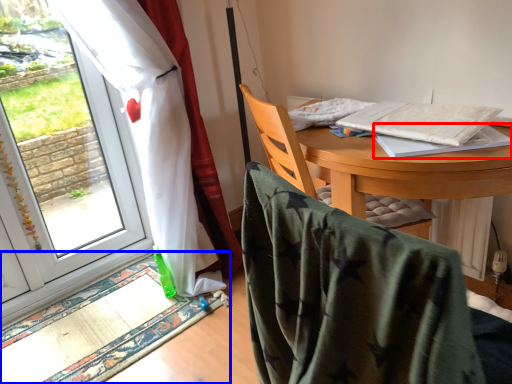
Question: Among these objects, which one is nearest to the camera, notebook (highlighted by a red box) or mat (highlighted by a blue box)?

Choices:
 (A) notebook
 (B) mat

Answer: (A)